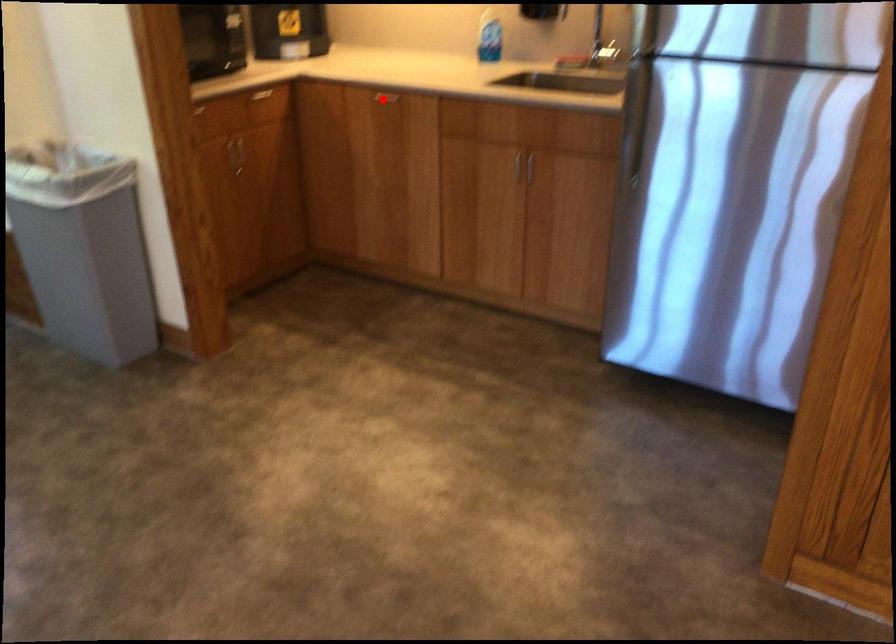
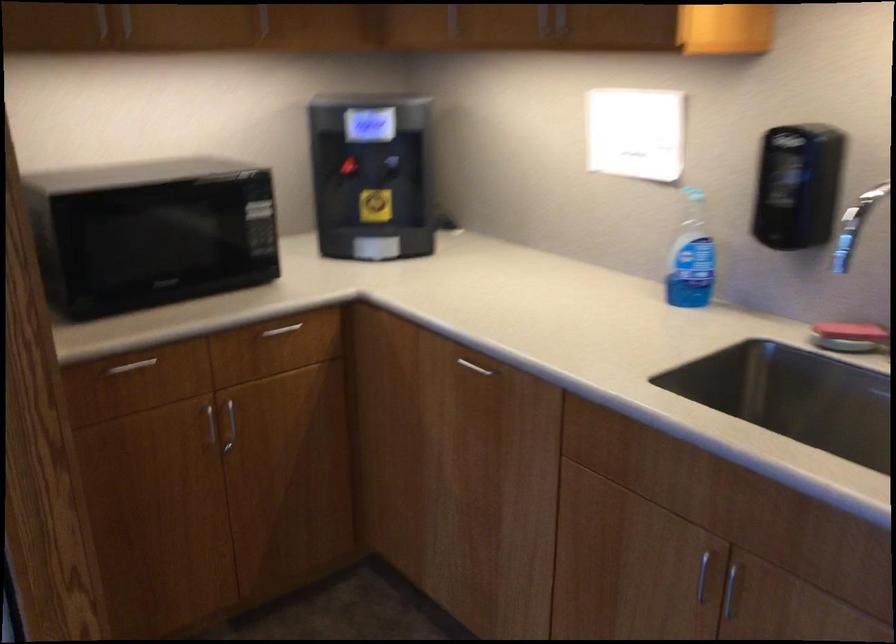
Question: I am providing you with two images of the same scene from different viewpoints. Image1 has a red point marked. In image2, the corresponding 3D location appears at what relative position? Reply with the corresponding letter.

Choices:
 (A) Closer
 (B) Farther

Answer: (A)